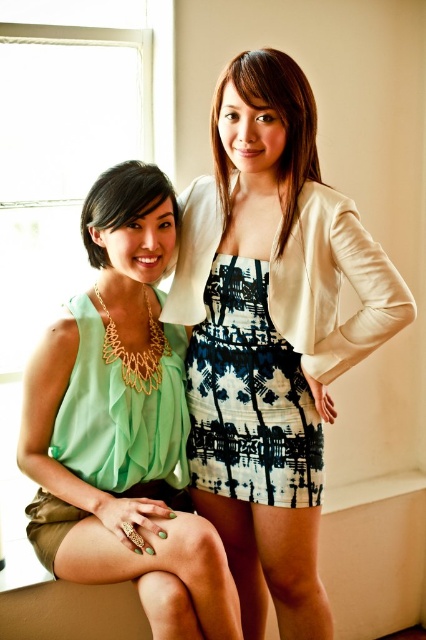
Question: Can you confirm if matte green blouse at left is positioned above matte beige blazer at center?

Choices:
 (A) no
 (B) yes

Answer: (A)

Question: Which point appears closest to the camera in this image?

Choices:
 (A) (333, 324)
 (B) (143, 538)
 (C) (131, 196)
 (D) (279, 177)

Answer: (B)

Question: Does matte beige blazer at center have a smaller size compared to matte gold necklace at center?

Choices:
 (A) yes
 (B) no

Answer: (B)

Question: Which of the following is the closest to the observer?

Choices:
 (A) printed fabric dress at center
 (B) matte beige blazer at center

Answer: (B)

Question: Which object is farther from the camera taking this photo?

Choices:
 (A) matte beige blazer at center
 (B) printed fabric dress at center
 (C) matte gold necklace at center

Answer: (B)

Question: Does matte green blouse at left come in front of printed fabric dress at center?

Choices:
 (A) yes
 (B) no

Answer: (A)